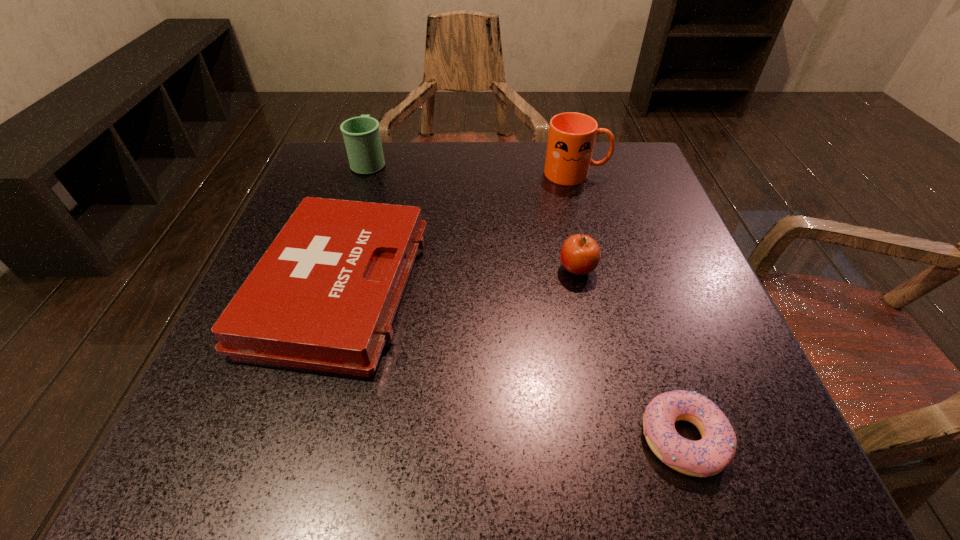
Where is `free space between the tallest object and the left mug`? free space between the tallest object and the left mug is located at coordinates (472, 167).

Where is `free point between the fourth tallest object and the nearest object`? This screenshot has width=960, height=540. free point between the fourth tallest object and the nearest object is located at coordinates (511, 363).

Locate an element on the screen. This screenshot has width=960, height=540. empty space between the shorter mug and the apple is located at coordinates (473, 215).

Locate an element on the screen. The height and width of the screenshot is (540, 960). object identified as the closest to the second shortest object is located at coordinates (361, 134).

I want to click on object that ranks as the closest to the first-aid kit, so click(361, 134).

Locate an element on the screen. free point that satisfies the following two spatial constraints: 1. on the handle side of the tallest object; 2. on the front side of the second shortest object is located at coordinates (607, 288).

I want to click on vacant space that satisfies the following two spatial constraints: 1. on the handle side of the right mug; 2. on the back side of the doughnut, so point(648,438).